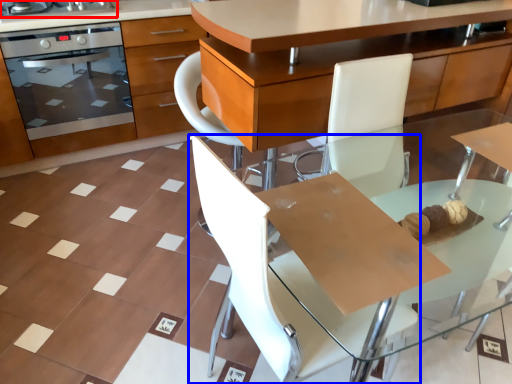
Question: Which object is further to the camera taking this photo, home appliance (highlighted by a red box) or chair (highlighted by a blue box)?

Choices:
 (A) home appliance
 (B) chair

Answer: (A)